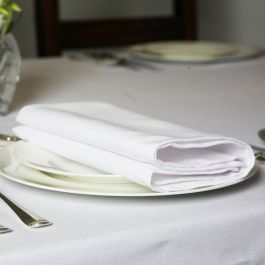
Where is `clear glass faceted vase`? Image resolution: width=265 pixels, height=265 pixels. clear glass faceted vase is located at coordinates (9, 71).